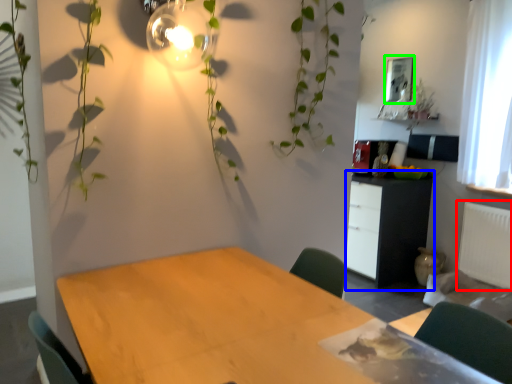
Question: Which object is positioned farthest from radiator (highlighted by a red box)? Select from cabinetry (highlighted by a blue box) and picture frame (highlighted by a green box).

Choices:
 (A) cabinetry
 (B) picture frame

Answer: (B)